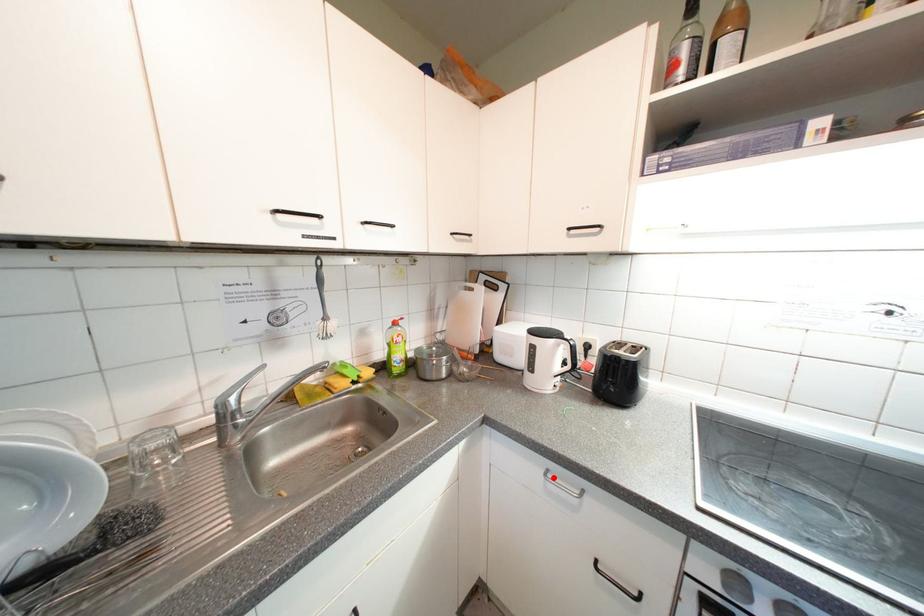
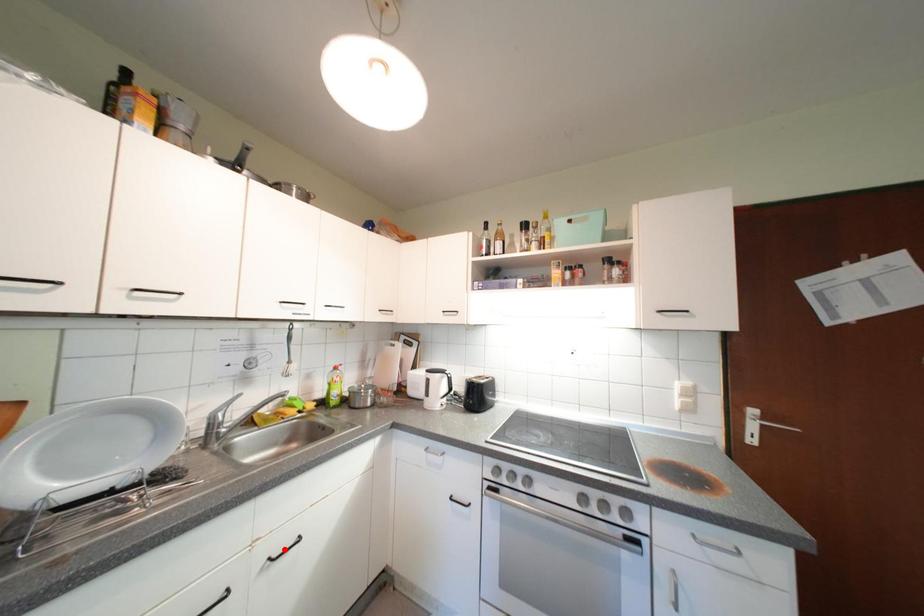
I am providing you with two images of the same scene from different viewpoints. A red point is marked on the first image and another point is marked on the second image. Is the red point in image1 aligned with the point shown in image2?

No